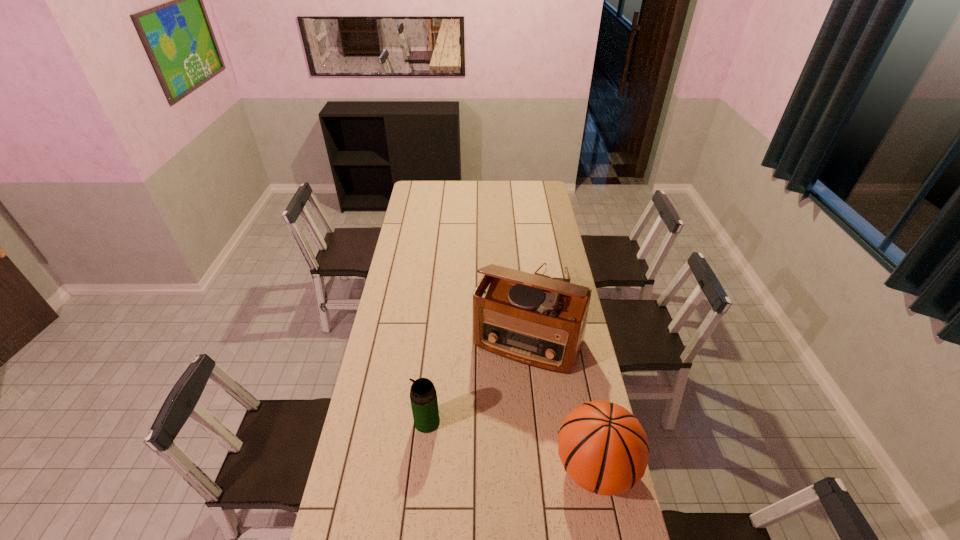
Where is `free space between the basketball and the leftmost object`? free space between the basketball and the leftmost object is located at coordinates (511, 444).

Identify the location of free space that is in between the leftmost object and the basketball. point(511,444).

The image size is (960, 540). Find the location of `object identified as the closest to the leftmost object`. object identified as the closest to the leftmost object is located at coordinates (538, 321).

You are a GUI agent. You are given a task and a screenshot of the screen. Output one action in this format:
    pyautogui.click(x=<x>, y=<y>)
    Task: Click on the object that is the second closest one to the basketball
    
    Given the screenshot: What is the action you would take?
    pyautogui.click(x=423, y=396)

Locate an element on the screen. The image size is (960, 540). free space that satisfies the following two spatial constraints: 1. on the front side of the basketball; 2. on the right side of the second farthest object is located at coordinates (541, 468).

This screenshot has height=540, width=960. Find the location of `vacant space that satisfies the following two spatial constraints: 1. on the front side of the tallest object; 2. on the right side of the basketball`. vacant space that satisfies the following two spatial constraints: 1. on the front side of the tallest object; 2. on the right side of the basketball is located at coordinates (541, 468).

What are the coordinates of `vacant space that satisfies the following two spatial constraints: 1. on the back side of the shortest object; 2. on the right side of the radio receiver` in the screenshot? It's located at (521, 278).

You are a GUI agent. You are given a task and a screenshot of the screen. Output one action in this format:
    pyautogui.click(x=<x>, y=<y>)
    Task: Click on the free space that satisfies the following two spatial constraints: 1. on the back side of the tallest object; 2. on the right side of the farthest object
    
    Given the screenshot: What is the action you would take?
    pyautogui.click(x=521, y=278)